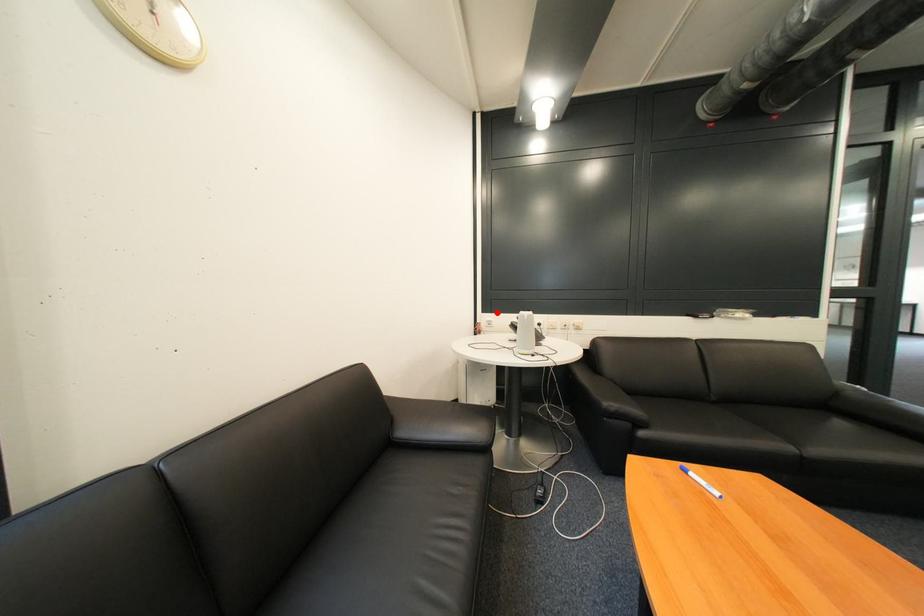
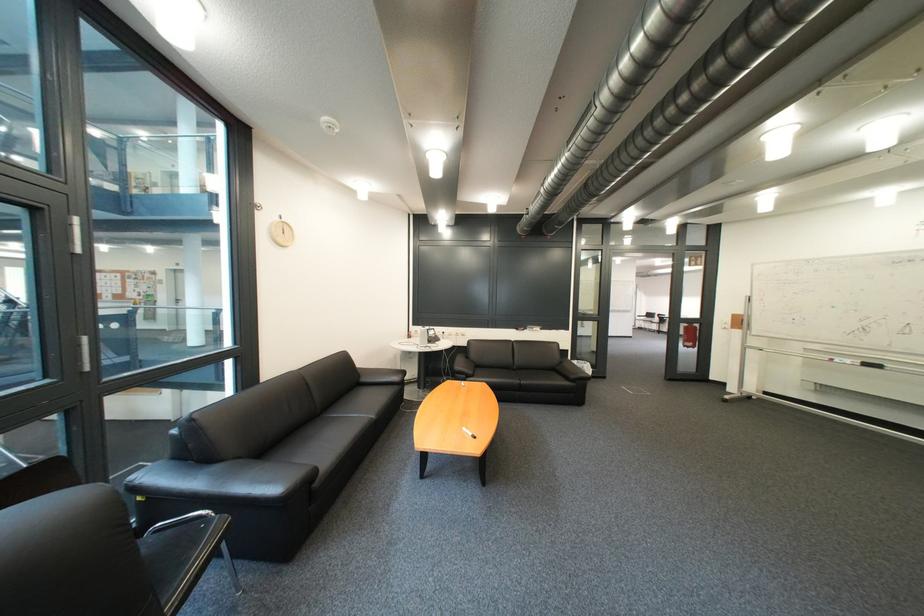
Where in the second image is the point corresponding to the highlighted location from the first image?

(428, 326)